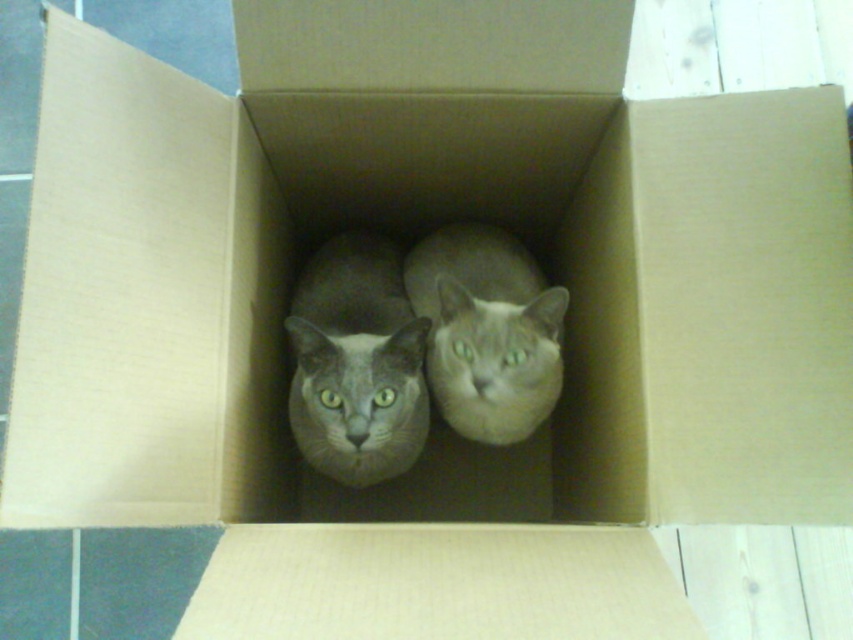
You are a photographer trying to capture both cats in the box. Since the gray fur cat at center is larger than the gray matte cat at center, which cat should you focus on to ensure both fit in the frame?

The gray fur cat at center is larger, so focusing on the gray matte cat at center would allow more space for the larger cat to fit within the frame.

You are standing at the point marked as point (357, 364) in the image. Which cat are you currently on?

The point (357, 364) is on the gray fur cat at center, so you are currently on the gray fur cat at center.

You are a photographer trying to capture both cats in the box. Since the box is open, you need to ensure that both the gray fur cat at center and the gray matte cat at center are fully visible in your shot. Based on their positions, which cat is closer to the left edge of the box?

The gray fur cat at center is positioned on the left side of the gray matte cat at center, so the gray fur cat at center is closer to the left edge of the box.